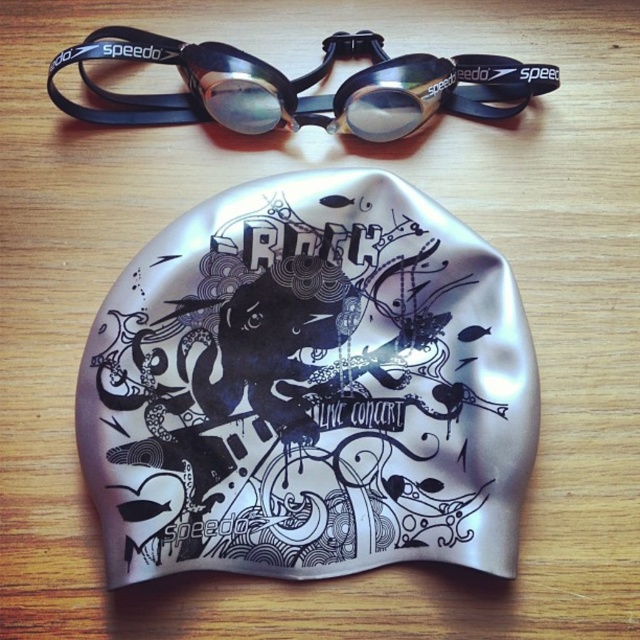
Question: Is silver matte swim cap at center bigger than black rubber goggles at upper center?

Choices:
 (A) yes
 (B) no

Answer: (A)

Question: Is the position of silver matte swim cap at center less distant than that of black rubber goggles at upper center?

Choices:
 (A) no
 (B) yes

Answer: (B)

Question: Observing the image, what is the correct spatial positioning of silver matte swim cap at center in reference to black rubber goggles at upper center?

Choices:
 (A) left
 (B) right

Answer: (B)

Question: Which of the following is the closest to the observer?

Choices:
 (A) (147, 33)
 (B) (156, 445)

Answer: (B)